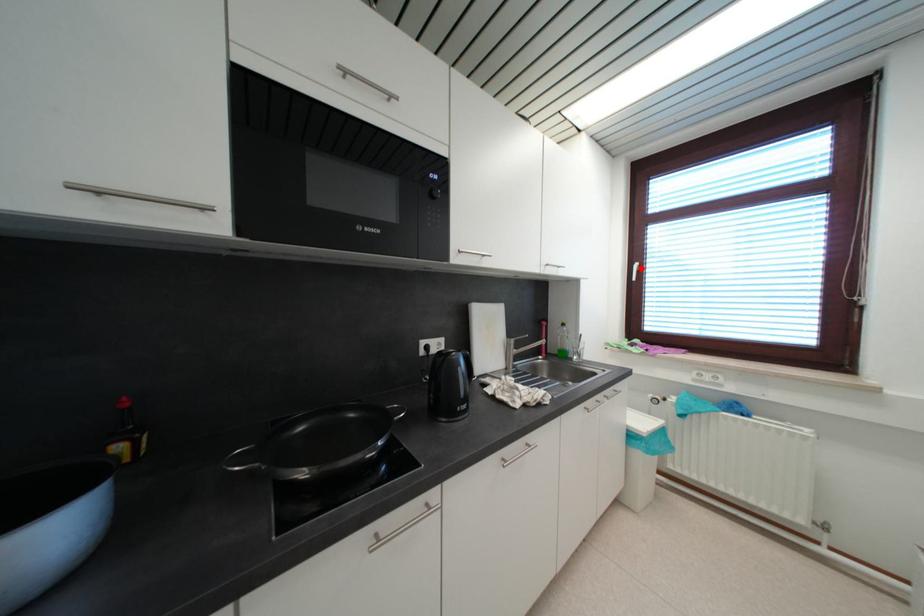
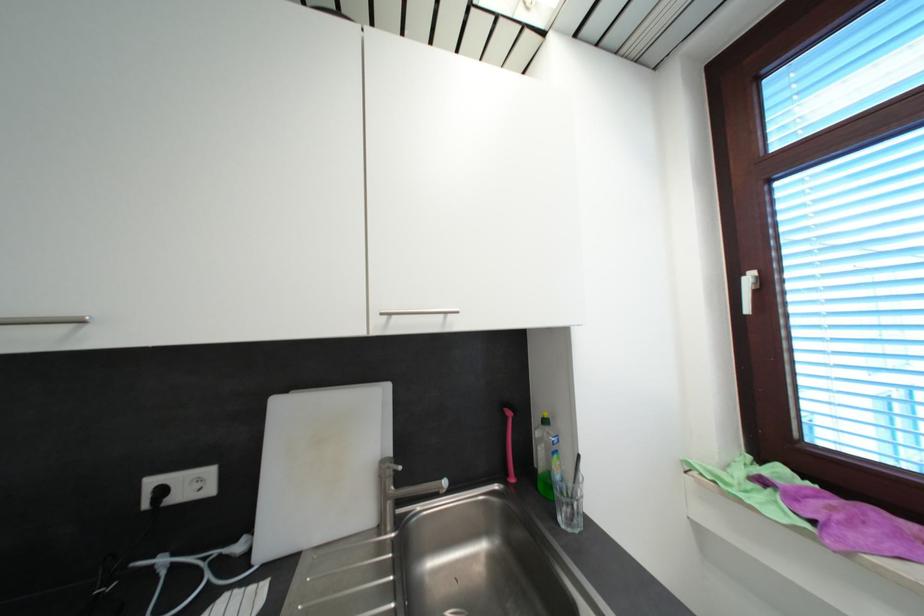
Locate, in the second image, the point that corresponds to the highlighted location in the first image.

(754, 281)